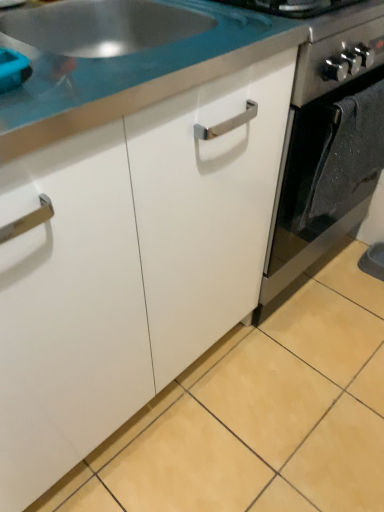
Question: Should I look upward or downward to see satin black oven at center?

Choices:
 (A) down
 (B) up

Answer: (B)

Question: Is white glossy countertop at upper center to the right of satin black oven at center from the viewer's perspective?

Choices:
 (A) no
 (B) yes

Answer: (A)

Question: Considering the relative sizes of white glossy countertop at upper center and satin black oven at center in the image provided, is white glossy countertop at upper center shorter than satin black oven at center?

Choices:
 (A) yes
 (B) no

Answer: (A)

Question: Is white glossy countertop at upper center positioned beyond the bounds of satin black oven at center?

Choices:
 (A) no
 (B) yes

Answer: (B)

Question: Is white glossy countertop at upper center to the left of satin black oven at center from the viewer's perspective?

Choices:
 (A) yes
 (B) no

Answer: (A)

Question: From a real-world perspective, is white glossy countertop at upper center on top of satin black oven at center?

Choices:
 (A) no
 (B) yes

Answer: (B)

Question: Is white glossy countertop at upper center closer to the viewer compared to satin black oven at center?

Choices:
 (A) no
 (B) yes

Answer: (B)

Question: From a real-world perspective, is satin black oven at center on white glossy countertop at upper center?

Choices:
 (A) no
 (B) yes

Answer: (A)

Question: Does satin black oven at center appear on the right side of white glossy countertop at upper center?

Choices:
 (A) yes
 (B) no

Answer: (A)

Question: Is satin black oven at center positioned beyond the bounds of white glossy countertop at upper center?

Choices:
 (A) yes
 (B) no

Answer: (A)

Question: Is satin black oven at center positioned far away from white glossy countertop at upper center?

Choices:
 (A) yes
 (B) no

Answer: (B)

Question: Is the position of satin black oven at center more distant than that of white glossy countertop at upper center?

Choices:
 (A) no
 (B) yes

Answer: (B)

Question: From a real-world perspective, is satin black oven at center physically below white glossy countertop at upper center?

Choices:
 (A) yes
 (B) no

Answer: (A)

Question: Is satin black oven at center in front of or behind white glossy countertop at upper center in the image?

Choices:
 (A) front
 (B) behind

Answer: (B)